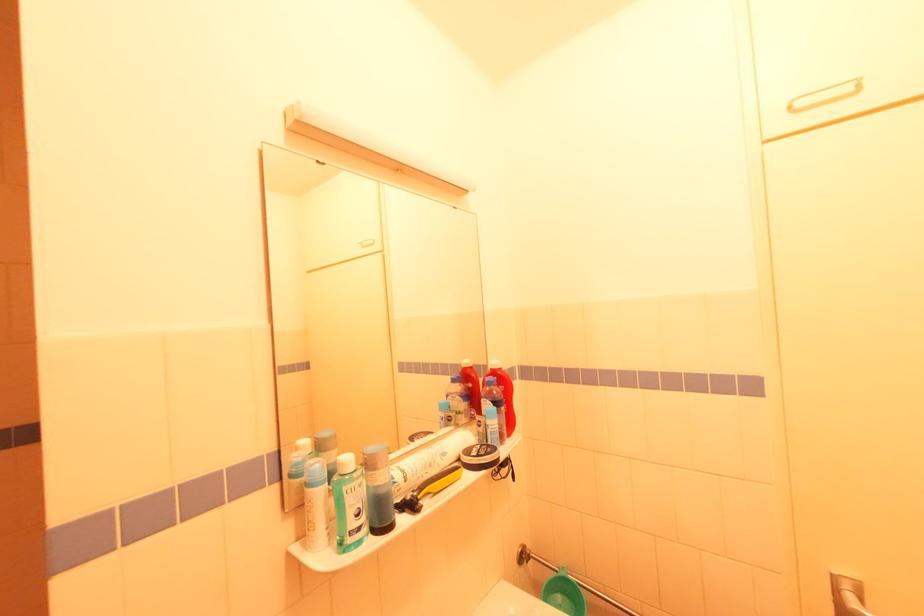
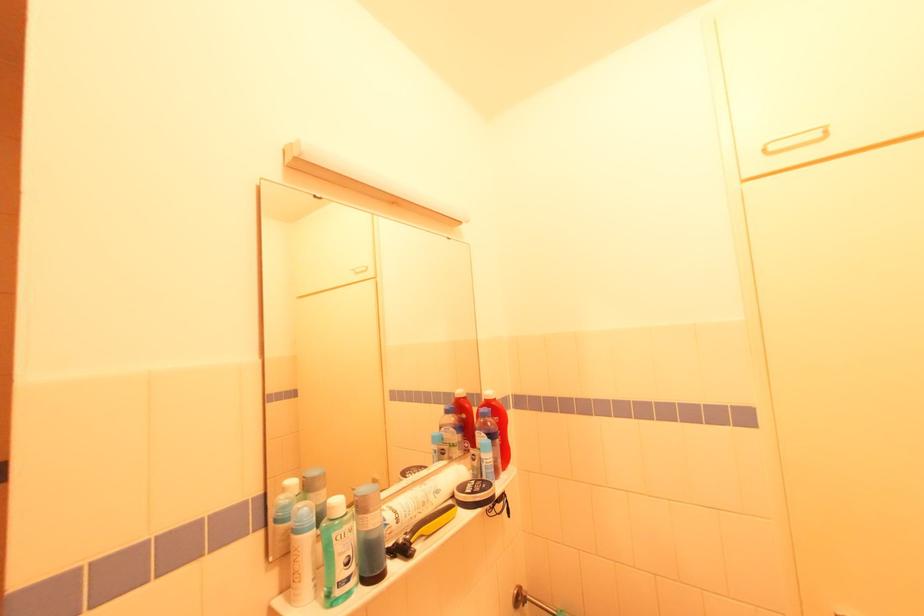
In the second image, find the point that corresponds to point 350,493 in the first image.

(341, 539)